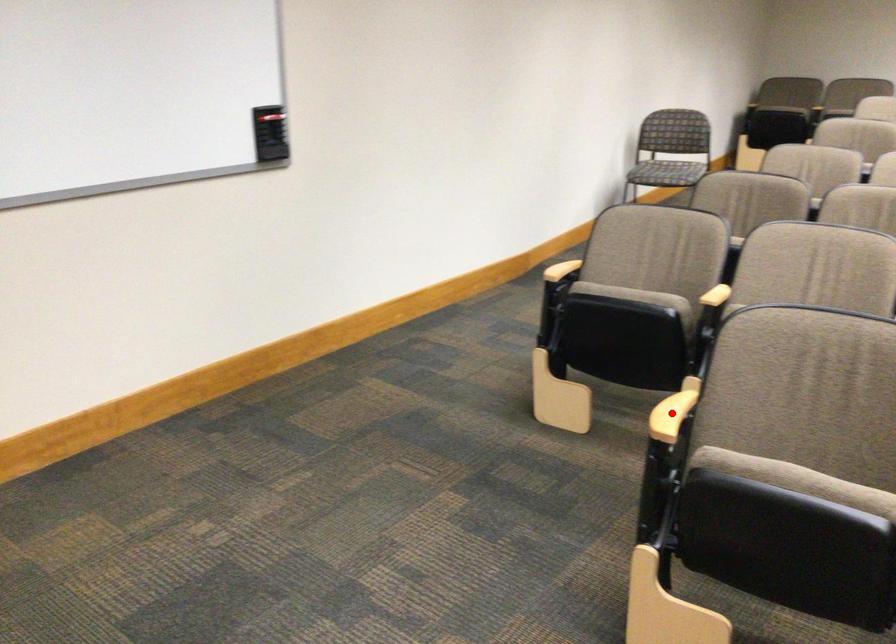
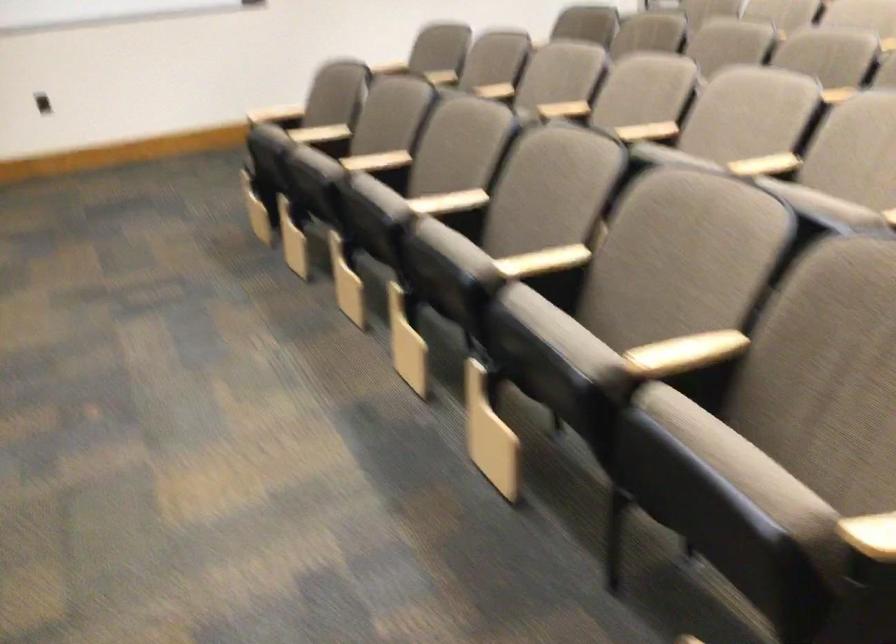
Question: I am providing you with two images of the same scene from different viewpoints. A red point is marked on the first image. At the location where the point appears in image 1, is it still visible in image 2?

Choices:
 (A) Yes
 (B) No

Answer: (B)